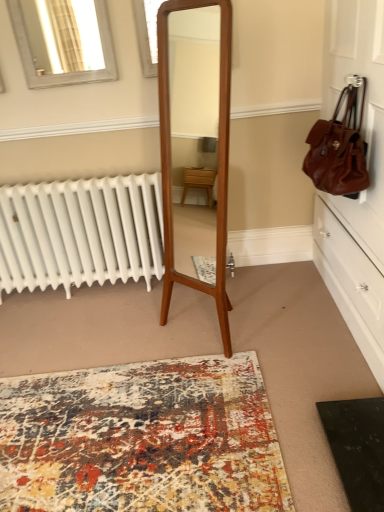
What is the approximate height of matte brown leather dresser at right?

It is 5.33 feet.

What do you see at coordinates (142, 439) in the screenshot? I see `textured multicolor rug at center` at bounding box center [142, 439].

The height and width of the screenshot is (512, 384). What are the coordinates of `silver metallic window at upper left, which is the first window from left to right` in the screenshot? It's located at (63, 41).

Which object is closer to the camera, silver metallic window at upper left, which is the first window from left to right, or matte brown leather dresser at right?

Positioned in front is matte brown leather dresser at right.

Is silver metallic window at upper left, the second window positioned from the right, inside or outside of matte brown leather dresser at right?

silver metallic window at upper left, the second window positioned from the right, lies outside matte brown leather dresser at right.

Is point (32, 60) closer or farther from the camera than point (379, 103)?

Point (32, 60).

Is silver metallic window at upper left, the second window positioned from the right, aimed at matte brown leather dresser at right?

No, silver metallic window at upper left, the second window positioned from the right, does not turn towards matte brown leather dresser at right.

Is matte glass window at upper center, the first window from the right, inside or outside of textured multicolor rug at center?

matte glass window at upper center, the first window from the right, is not inside textured multicolor rug at center, it's outside.

From a real-world perspective, is matte glass window at upper center, the first window from the right, physically below textured multicolor rug at center?

No, from a real-world perspective, matte glass window at upper center, the first window from the right, is not beneath textured multicolor rug at center.

Could you measure the distance between matte glass window at upper center, the first window from the right, and textured multicolor rug at center?

A distance of 1.93 meters exists between matte glass window at upper center, the first window from the right, and textured multicolor rug at center.

Looking at their sizes, would you say textured multicolor rug at center is wider or thinner than matte glass window at upper center, the first window from the right?

In the image, textured multicolor rug at center appears to be wider than matte glass window at upper center, the first window from the right.

From the picture: Considering the relative sizes of textured multicolor rug at center and matte glass window at upper center, which is counted as the second window, starting from the left, in the image provided, is textured multicolor rug at center smaller than matte glass window at upper center, which is counted as the second window, starting from the left,?

Incorrect, textured multicolor rug at center is not smaller in size than matte glass window at upper center, which is counted as the second window, starting from the left.

Is textured multicolor rug at center positioned with its back to matte glass window at upper center, the first window from the right?

That's not correct — textured multicolor rug at center is not looking away from matte glass window at upper center, the first window from the right.

Does textured multicolor rug at center appear on the right side of matte glass window at upper center, the first window from the right?

No, textured multicolor rug at center is not to the right of matte glass window at upper center, the first window from the right.

From the image's perspective, between matte glass window at upper center, the first window from the right, and matte brown leather dresser at right, who is located below?

matte brown leather dresser at right is shown below in the image.

Considering the sizes of objects matte glass window at upper center, the first window from the right, and matte brown leather dresser at right in the image provided, who is shorter, matte glass window at upper center, the first window from the right, or matte brown leather dresser at right?

matte glass window at upper center, the first window from the right.

How different are the orientations of matte glass window at upper center, which is counted as the second window, starting from the left, and matte brown leather dresser at right in degrees?

The facing directions of matte glass window at upper center, which is counted as the second window, starting from the left, and matte brown leather dresser at right are 89.7 degrees apart.

Consider the image. Can you confirm if matte glass window at upper center, the first window from the right, is shorter than silver metallic window at upper left, which is the first window from left to right?

Indeed, matte glass window at upper center, the first window from the right, has a lesser height compared to silver metallic window at upper left, which is the first window from left to right.

Does point (156, 44) lie behind point (98, 37)?

No.

Does matte glass window at upper center, the first window from the right, lie behind silver metallic window at upper left, the second window positioned from the right?

No.

Is matte glass window at upper center, which is counted as the second window, starting from the left, aimed at silver metallic window at upper left, which is the first window from left to right?

No, matte glass window at upper center, which is counted as the second window, starting from the left, is not aimed at silver metallic window at upper left, which is the first window from left to right.

Considering the sizes of objects brown leather handbag at upper right and silver metallic window at upper left, which is the first window from left to right, in the image provided, who is taller, brown leather handbag at upper right or silver metallic window at upper left, which is the first window from left to right,?

brown leather handbag at upper right.

Is brown leather handbag at upper right facing towards silver metallic window at upper left, the second window positioned from the right?

Yes, brown leather handbag at upper right is facing silver metallic window at upper left, the second window positioned from the right.

From the image's perspective, who appears lower, brown leather handbag at upper right or silver metallic window at upper left, which is the first window from left to right?

brown leather handbag at upper right is shown below in the image.

Between brown leather handbag at upper right and silver metallic window at upper left, which is the first window from left to right, which one has larger size?

brown leather handbag at upper right.

Does matte brown leather dresser at right turn towards matte glass window at upper center, the first window from the right?

Yes.

Would you say matte brown leather dresser at right is a long distance from matte glass window at upper center, which is counted as the second window, starting from the left?

matte brown leather dresser at right is far away from matte glass window at upper center, which is counted as the second window, starting from the left.

Looking at their sizes, would you say matte brown leather dresser at right is wider or thinner than matte glass window at upper center, which is counted as the second window, starting from the left?

In the image, matte brown leather dresser at right appears to be wider than matte glass window at upper center, which is counted as the second window, starting from the left.

From the image's perspective, would you say matte brown leather dresser at right is shown under matte glass window at upper center, the first window from the right?

Correct, matte brown leather dresser at right appears lower than matte glass window at upper center, the first window from the right, in the image.

From the matte brown leather dresser at right, count the 2nd window to the left and point to it. Please provide its 2D coordinates.

[(63, 41)]

Where is `the 1st window behind the textured multicolor rug at center`? The width and height of the screenshot is (384, 512). the 1st window behind the textured multicolor rug at center is located at coordinates (147, 34).

Considering their positions, is matte brown leather dresser at right positioned further to textured multicolor rug at center than brown leather handbag at upper right?

Among the two, brown leather handbag at upper right is located further to textured multicolor rug at center.

Based on their spatial positions, is matte brown leather dresser at right or textured multicolor rug at center further from silver metallic window at upper left, the second window positioned from the right?

textured multicolor rug at center is positioned further to the anchor silver metallic window at upper left, the second window positioned from the right.

Looking at this image, based on their spatial positions, is silver metallic window at upper left, which is the first window from left to right, or matte brown leather dresser at right closer to matte glass window at upper center, the first window from the right?

silver metallic window at upper left, which is the first window from left to right, lies closer to matte glass window at upper center, the first window from the right, than the other object.

Looking at the image, which one is located further to textured multicolor rug at center, matte brown leather dresser at right or matte glass window at upper center, which is counted as the second window, starting from the left?

matte glass window at upper center, which is counted as the second window, starting from the left, is positioned further to the anchor textured multicolor rug at center.

When comparing their distances from textured multicolor rug at center, does matte brown leather dresser at right or silver metallic window at upper left, which is the first window from left to right, seem closer?

The object closer to textured multicolor rug at center is matte brown leather dresser at right.

Estimate the real-world distances between objects in this image. Which object is closer to silver metallic window at upper left, which is the first window from left to right, matte glass window at upper center, the first window from the right, or matte brown leather dresser at right?

The object closer to silver metallic window at upper left, which is the first window from left to right, is matte glass window at upper center, the first window from the right.

Which object lies further to the anchor point matte brown leather dresser at right, textured multicolor rug at center or brown leather handbag at upper right?

textured multicolor rug at center.

Estimate the real-world distances between objects in this image. Which object is closer to matte glass window at upper center, which is counted as the second window, starting from the left, brown leather handbag at upper right or matte brown leather dresser at right?

brown leather handbag at upper right is positioned closer to the anchor matte glass window at upper center, which is counted as the second window, starting from the left.

Where is `handbag between matte glass window at upper center, which is counted as the second window, starting from the left, and textured multicolor rug at center vertically`? handbag between matte glass window at upper center, which is counted as the second window, starting from the left, and textured multicolor rug at center vertically is located at coordinates (339, 148).

Identify the location of window between silver metallic window at upper left, which is the first window from left to right, and brown leather handbag at upper right, in the horizontal direction. Image resolution: width=384 pixels, height=512 pixels. tap(147, 34).

Where is `window between silver metallic window at upper left, the second window positioned from the right, and matte brown leather dresser at right, in the horizontal direction`? The width and height of the screenshot is (384, 512). window between silver metallic window at upper left, the second window positioned from the right, and matte brown leather dresser at right, in the horizontal direction is located at coordinates (147, 34).

At what (x,y) coordinates should I click in order to perform the action: click on handbag between matte brown leather dresser at right and matte glass window at upper center, which is counted as the second window, starting from the left, from front to back. Please return your answer as a coordinate pair (x, y). Image resolution: width=384 pixels, height=512 pixels. Looking at the image, I should click on (339, 148).